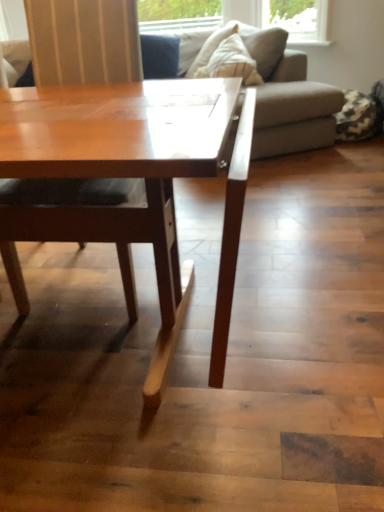
Locate an element on the screen. Image resolution: width=384 pixels, height=512 pixels. matte wood chair at center is located at coordinates (73, 221).

In order to face matte wood chair at center, should I rotate leftwards or rightwards?

Turn left approximately 14.532 degrees to face it.

What do you see at coordinates (73, 221) in the screenshot? This screenshot has height=512, width=384. I see `matte wood chair at center` at bounding box center [73, 221].

The width and height of the screenshot is (384, 512). What do you see at coordinates (289, 101) in the screenshot?
I see `gray fabric couch at upper center` at bounding box center [289, 101].

What is the approximate height of gray fabric couch at upper center?

gray fabric couch at upper center is 83.06 centimeters in height.

You are a GUI agent. You are given a task and a screenshot of the screen. Output one action in this format:
    pyautogui.click(x=<x>, y=<y>)
    Task: Click on the gray fabric couch at upper center
    Image resolution: width=384 pixels, height=512 pixels.
    Given the screenshot: What is the action you would take?
    pyautogui.click(x=289, y=101)

Locate an element on the screen. The image size is (384, 512). matte wood chair at center is located at coordinates (73, 221).

Which is more to the left, matte wood chair at center or gray fabric couch at upper center?

From the viewer's perspective, matte wood chair at center appears more on the left side.

Based on the photo, considering the positions of objects matte wood chair at center and gray fabric couch at upper center in the image provided, who is in front, matte wood chair at center or gray fabric couch at upper center?

matte wood chair at center is more forward.

Considering the positions of point (141, 196) and point (263, 156), is point (141, 196) closer or farther from the camera than point (263, 156)?

Clearly, point (141, 196) is closer to the camera than point (263, 156).

From the image's perspective, is matte wood chair at center located above or below gray fabric couch at upper center?

From the image's perspective, matte wood chair at center appears below gray fabric couch at upper center.

From a real-world perspective, is matte wood chair at center beneath gray fabric couch at upper center?

Incorrect, from a real-world perspective, matte wood chair at center is higher than gray fabric couch at upper center.

Considering the relative sizes of matte wood chair at center and gray fabric couch at upper center in the image provided, is matte wood chair at center wider than gray fabric couch at upper center?

No, matte wood chair at center is not wider than gray fabric couch at upper center.

Can you confirm if matte wood chair at center is shorter than gray fabric couch at upper center?

No.

Which of these two, matte wood chair at center or gray fabric couch at upper center, is bigger?

gray fabric couch at upper center is bigger.

Can we say matte wood chair at center lies outside gray fabric couch at upper center?

matte wood chair at center lies outside gray fabric couch at upper center's area.

Is matte wood chair at center placed right next to gray fabric couch at upper center?

No, matte wood chair at center is not touching gray fabric couch at upper center.

Is matte wood chair at center looking in the opposite direction of gray fabric couch at upper center?

That's right, matte wood chair at center is facing away from gray fabric couch at upper center.

What's the angular difference between matte wood chair at center and gray fabric couch at upper center's facing directions?

matte wood chair at center and gray fabric couch at upper center are facing 64 degrees away from each other.

In the image, there is a matte wood chair at center. Where is `studio couch below it (from a real-world perspective)`? The width and height of the screenshot is (384, 512). studio couch below it (from a real-world perspective) is located at coordinates (289, 101).

Considering the relative positions of gray fabric couch at upper center and matte wood chair at center in the image provided, is gray fabric couch at upper center to the right of matte wood chair at center from the viewer's perspective?

Indeed, gray fabric couch at upper center is positioned on the right side of matte wood chair at center.

Relative to matte wood chair at center, is gray fabric couch at upper center in front or behind?

Clearly, gray fabric couch at upper center is behind matte wood chair at center.

Is point (272, 127) closer or farther from the camera than point (9, 211)?

Clearly, point (272, 127) is more distant from the camera than point (9, 211).

From the image's perspective, does gray fabric couch at upper center appear lower than matte wood chair at center?

Incorrect, from the image's perspective, gray fabric couch at upper center is higher than matte wood chair at center.

From a real-world perspective, is gray fabric couch at upper center located beneath matte wood chair at center?

Correct, in the physical world, gray fabric couch at upper center is lower than matte wood chair at center.

Considering the sizes of gray fabric couch at upper center and matte wood chair at center in the image, is gray fabric couch at upper center wider or thinner than matte wood chair at center?

Considering their sizes, gray fabric couch at upper center looks broader than matte wood chair at center.

From the picture: In terms of height, does gray fabric couch at upper center look taller or shorter compared to matte wood chair at center?

gray fabric couch at upper center is shorter than matte wood chair at center.

Can you confirm if gray fabric couch at upper center is smaller than matte wood chair at center?

Incorrect, gray fabric couch at upper center is not smaller in size than matte wood chair at center.

Would you say gray fabric couch at upper center is outside matte wood chair at center?

Yes, gray fabric couch at upper center is outside of matte wood chair at center.

Is gray fabric couch at upper center beside matte wood chair at center?

No, gray fabric couch at upper center is not with matte wood chair at center.

Is matte wood chair at center at the back of gray fabric couch at upper center?

No, matte wood chair at center is not at the back of gray fabric couch at upper center.

The image size is (384, 512). I want to click on chair that appears in front of the gray fabric couch at upper center, so click(x=73, y=221).

Find the location of a particular element. This screenshot has width=384, height=512. chair to the left of gray fabric couch at upper center is located at coordinates (73, 221).

In the image, there is a gray fabric couch at upper center. At what (x,y) coordinates should I click in order to perform the action: click on chair below it (from the image's perspective). Please return your answer as a coordinate pair (x, y). The image size is (384, 512). Looking at the image, I should click on (73, 221).